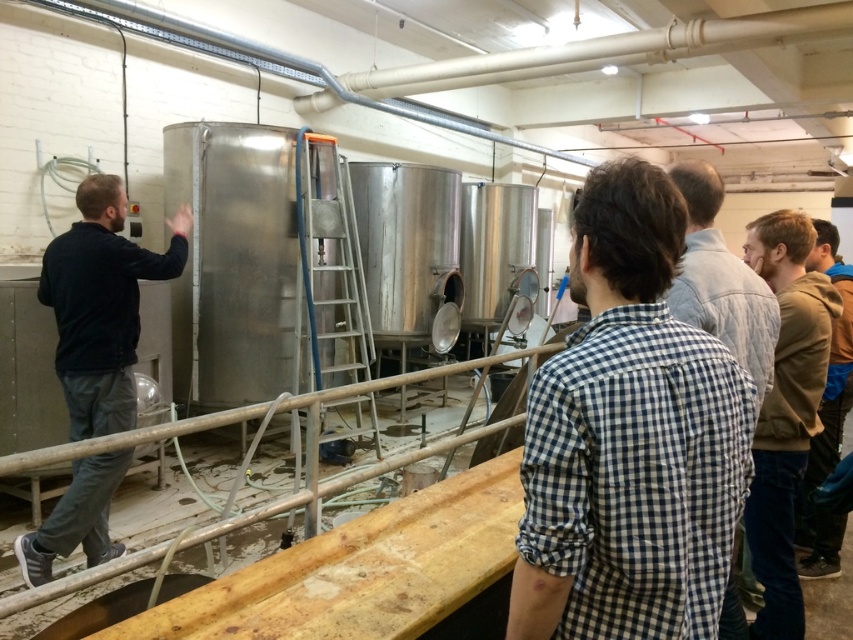
Question: Which object is closer to the camera taking this photo?

Choices:
 (A) brown leather jacket at lower right
 (B) checkered shirt at center
 (C) dark blue sweater at left

Answer: (B)

Question: Does dark blue sweater at left come behind checkered shirt at center?

Choices:
 (A) yes
 (B) no

Answer: (A)

Question: Considering the real-world distances, which object is closest to the brown leather jacket at lower right?

Choices:
 (A) green sweater at center
 (B) checkered fabric shirt at center
 (C) checkered shirt at center
 (D) dark blue sweater at left

Answer: (A)

Question: Is the position of dark blue sweater at left more distant than that of checkered shirt at center?

Choices:
 (A) yes
 (B) no

Answer: (A)

Question: From the image, what is the correct spatial relationship of checkered shirt at center in relation to brown leather jacket at lower right?

Choices:
 (A) left
 (B) right

Answer: (A)

Question: Which of the following is the closest to the observer?

Choices:
 (A) checkered shirt at center
 (B) dark blue sweater at left

Answer: (A)